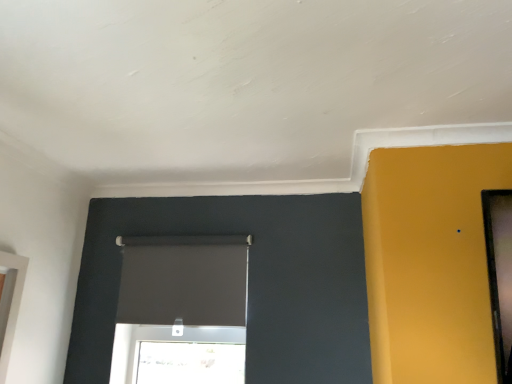
Question: Is matte black roller blind at center, which appears as the 1th window when viewed from the right, smaller than white glossy window at left, which appears as the 2th window when viewed from the back?

Choices:
 (A) yes
 (B) no

Answer: (B)

Question: From the image's perspective, is matte black roller blind at center, which appears as the 1th window when viewed from the right, located beneath white glossy window at left, the 1th window viewed from the front?

Choices:
 (A) yes
 (B) no

Answer: (B)

Question: From a real-world perspective, is matte black roller blind at center, the first window from the back, physically above white glossy window at left, the 1th window viewed from the front?

Choices:
 (A) yes
 (B) no

Answer: (A)

Question: Is matte black roller blind at center, the second window in the left-to-right sequence, not within white glossy window at left, which is the 2th window in right-to-left order?

Choices:
 (A) no
 (B) yes

Answer: (B)

Question: Is matte black roller blind at center, the 2th window when ordered from front to back, to the left of white glossy window at left, which is the 2th window in right-to-left order, from the viewer's perspective?

Choices:
 (A) yes
 (B) no

Answer: (B)

Question: From the image's perspective, is matte black roller blind at center, the second window in the left-to-right sequence, on white glossy window at left, which is the 2th window in right-to-left order?

Choices:
 (A) yes
 (B) no

Answer: (A)

Question: Considering the relative sizes of white glossy window at left, which appears as the 2th window when viewed from the back, and matte black roller blind at center, which appears as the 1th window when viewed from the right, in the image provided, is white glossy window at left, which appears as the 2th window when viewed from the back, shorter than matte black roller blind at center, which appears as the 1th window when viewed from the right,?

Choices:
 (A) yes
 (B) no

Answer: (B)

Question: Can you confirm if white glossy window at left, which is the 2th window in right-to-left order, is positioned to the right of matte black roller blind at center, the 2th window when ordered from front to back?

Choices:
 (A) no
 (B) yes

Answer: (A)

Question: Is the surface of white glossy window at left, the 1th window viewed from the front, in direct contact with matte black roller blind at center, which appears as the 1th window when viewed from the right?

Choices:
 (A) no
 (B) yes

Answer: (A)

Question: From the image's perspective, does white glossy window at left, which appears as the 2th window when viewed from the back, appear lower than matte black roller blind at center, the 2th window when ordered from front to back?

Choices:
 (A) yes
 (B) no

Answer: (A)

Question: Does white glossy window at left, which is the 2th window in right-to-left order, have a greater height compared to matte black roller blind at center, the first window from the back?

Choices:
 (A) no
 (B) yes

Answer: (B)

Question: Is white glossy window at left, the 1th window viewed from the front, in front of matte black roller blind at center, the first window from the back?

Choices:
 (A) no
 (B) yes

Answer: (B)

Question: Based on their positions, is white glossy window at left, the 1th window viewed from the front, located to the left or right of matte black roller blind at center, which appears as the 1th window when viewed from the right?

Choices:
 (A) right
 (B) left

Answer: (B)